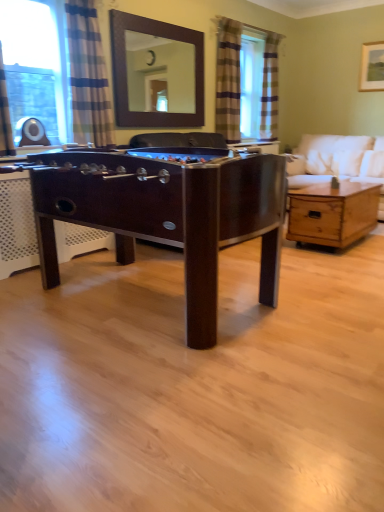
Question: Does white fabric couch at right turn towards wooden coffee table at center?

Choices:
 (A) yes
 (B) no

Answer: (A)

Question: Is white fabric couch at right far from wooden coffee table at center?

Choices:
 (A) no
 (B) yes

Answer: (B)

Question: Does white fabric couch at right appear on the left side of wooden coffee table at center?

Choices:
 (A) yes
 (B) no

Answer: (B)

Question: Is white fabric couch at right in front of wooden coffee table at center?

Choices:
 (A) no
 (B) yes

Answer: (A)

Question: From a real-world perspective, does white fabric couch at right stand above wooden coffee table at center?

Choices:
 (A) yes
 (B) no

Answer: (A)

Question: In terms of width, does striped fabric curtain at right, marked as the 3th curtain in a left-to-right arrangement, look wider or thinner when compared to blue striped curtain at left?

Choices:
 (A) thin
 (B) wide

Answer: (A)

Question: Considering the positions of point (274, 58) and point (57, 57), is point (274, 58) closer or farther from the camera than point (57, 57)?

Choices:
 (A) farther
 (B) closer

Answer: (A)

Question: From a real-world perspective, relative to blue striped curtain at left, is striped fabric curtain at right, placed as the first curtain when sorted from back to front, vertically above or below?

Choices:
 (A) above
 (B) below

Answer: (A)

Question: In the image, is striped fabric curtain at right, marked as the 3th curtain in a left-to-right arrangement, positioned in front of or behind blue striped curtain at left?

Choices:
 (A) front
 (B) behind

Answer: (B)

Question: Looking at the image, does wooden coffee table at center seem bigger or smaller compared to white fabric couch at right?

Choices:
 (A) small
 (B) big

Answer: (A)

Question: Considering their positions, is wooden coffee table at center located in front of or behind white fabric couch at right?

Choices:
 (A) front
 (B) behind

Answer: (A)

Question: Considering the positions of wooden coffee table at center and white fabric couch at right in the image, is wooden coffee table at center taller or shorter than white fabric couch at right?

Choices:
 (A) short
 (B) tall

Answer: (A)

Question: Considering the positions of point (364, 205) and point (311, 142), is point (364, 205) closer or farther from the camera than point (311, 142)?

Choices:
 (A) farther
 (B) closer

Answer: (B)

Question: From a real-world perspective, is wooden picture frame at upper right physically located above or below dark wood foosball table at center?

Choices:
 (A) above
 (B) below

Answer: (A)

Question: Which is correct: wooden picture frame at upper right is inside dark wood foosball table at center, or outside of it?

Choices:
 (A) outside
 (B) inside

Answer: (A)